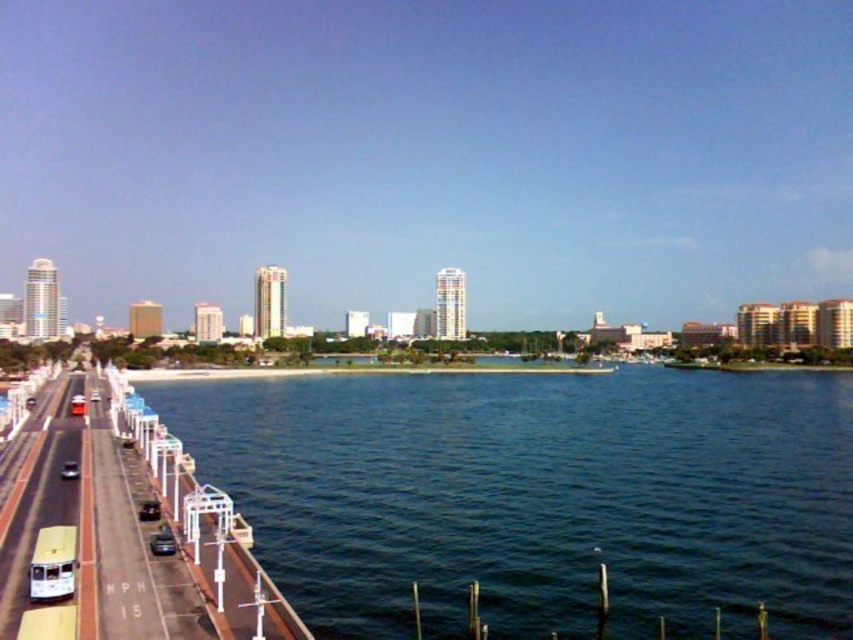
Question: Is clear blue water at center thinner than white glossy bus at left?

Choices:
 (A) no
 (B) yes

Answer: (A)

Question: Does white glossy bus at left have a lesser width compared to shiny black car at lower left?

Choices:
 (A) yes
 (B) no

Answer: (B)

Question: Among these objects, which one is farthest from the camera?

Choices:
 (A) shiny silver car at lower left
 (B) shiny black car at lower left

Answer: (A)

Question: Which point is closer to the camera taking this photo?

Choices:
 (A) (67, 484)
 (B) (70, 461)

Answer: (A)

Question: Which of the following is the closest to the observer?

Choices:
 (A) (77, 376)
 (B) (62, 474)
 (C) (709, 385)

Answer: (B)

Question: In this image, where is clear blue water at center located relative to white glossy bus at left?

Choices:
 (A) above
 (B) below

Answer: (B)